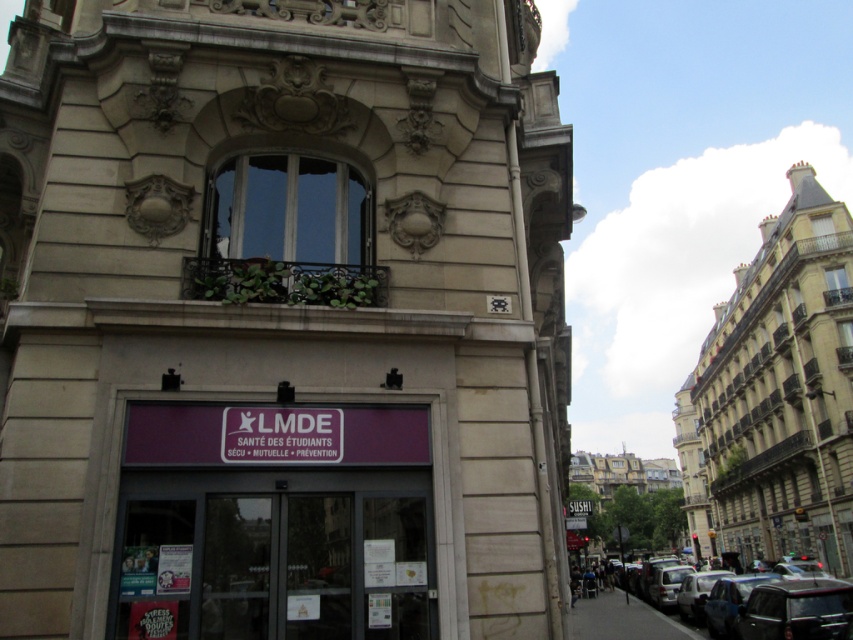
You are a tourist standing on the sidewalk in front of the beige stone tower at center. You want to take a photo of the tower without any obstructions. Is the metallic silver car at lower right blocking your view of the tower?

The beige stone tower at center is in front of the metallic silver car at lower right, so the car is behind the tower and not blocking your view.

You are a tourist in Paris and want to take a photo of the beige stone tower at center. However, there is a metallic silver car at lower right blocking the view. Can you estimate if the tower will be fully visible in the photo if you move to the left side of the street?

The beige stone tower at center is smaller in size compared to the metallic silver car at lower right. Since the car is larger, it might block more of the view, but the tower could still be partially visible depending on the distance and angle. However, without knowing the exact positioning or distance between them, it is hard to determine if the tower will be fully visible.

You are a tourist standing in front of the beige stone tower at center. You want to take a photo of the tower with your phone. Your phone has a standard camera with a maximum zoom of 5 meters. Will the tower be in focus if you take the photo from your current position?

The beige stone tower at center is 12.86 meters away from you. Since your phone can only zoom up to 5 meters, the tower will not be in focus at this distance. You need to move closer to within 5 meters for the photo to be clear.